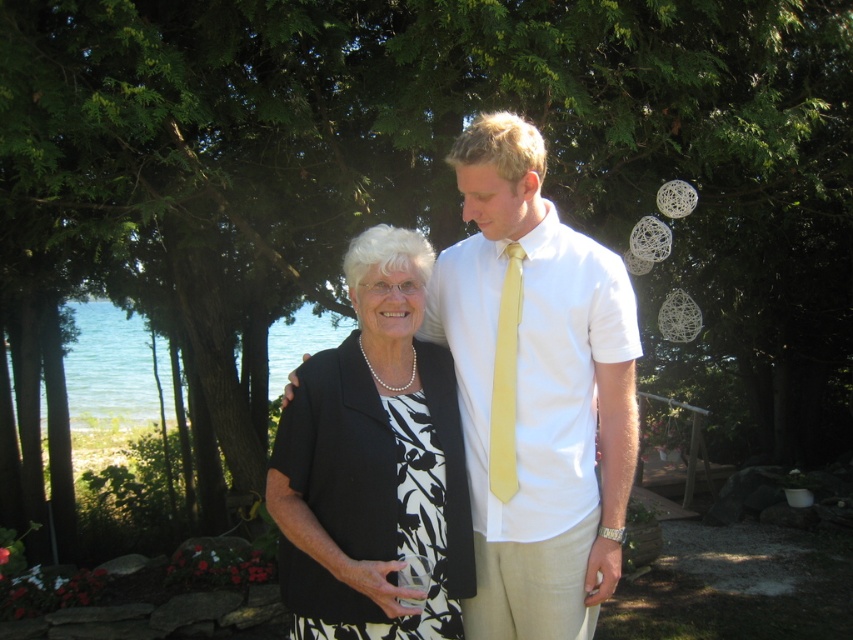
Is black matte dress at center taller than yellow satin tie at center?

Yes.

Is black matte dress at center positioned before yellow satin tie at center?

Yes.

Who is more distant from viewer, (401, 328) or (512, 406)?

Positioned behind is point (512, 406).

Locate an element on the screen. black matte dress at center is located at coordinates (373, 464).

Which is behind, point (561, 352) or point (509, 449)?

Point (509, 449)

The image size is (853, 640). I want to click on white cotton shirt at center, so click(535, 390).

Who is positioned more to the right, white cotton shirt at center or black matte dress at center?

white cotton shirt at center is more to the right.

Does point (614, 276) come in front of point (473, 593)?

No, it is not.

The width and height of the screenshot is (853, 640). What do you see at coordinates (535, 390) in the screenshot?
I see `white cotton shirt at center` at bounding box center [535, 390].

Find the location of `white cotton shirt at center`. white cotton shirt at center is located at coordinates (535, 390).